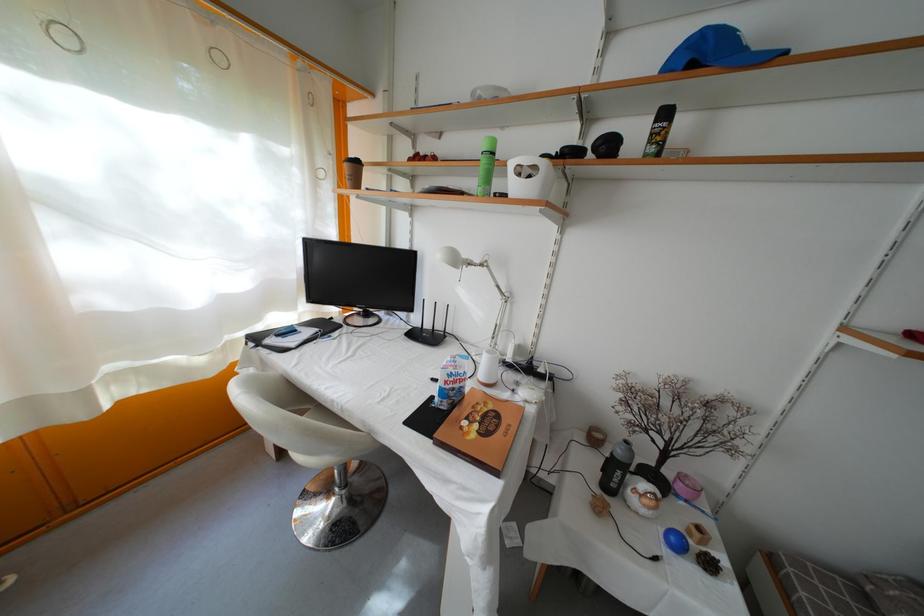
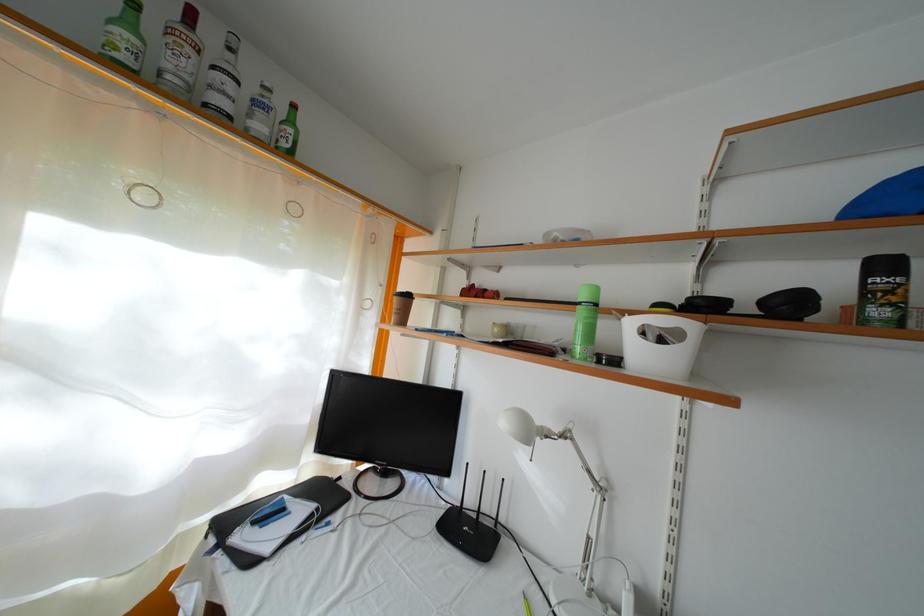
In the second image, find the point that corresponds to pixel 332 334 in the first image.

(334, 506)